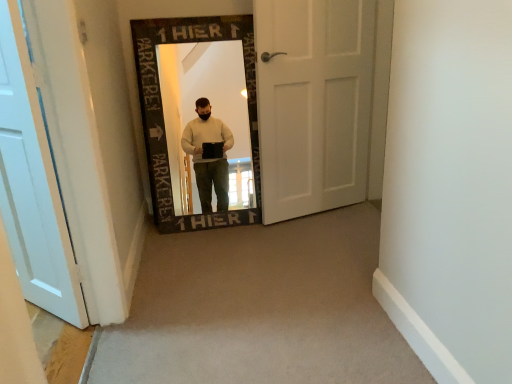
You are a GUI agent. You are given a task and a screenshot of the screen. Output one action in this format:
    pyautogui.click(x=<x>, y=<y>)
    Task: Click on the free point below white matte door at center, which is the 2th door from front to back (from a real-world perspective)
    The image size is (512, 384).
    Given the screenshot: What is the action you would take?
    tap(306, 216)